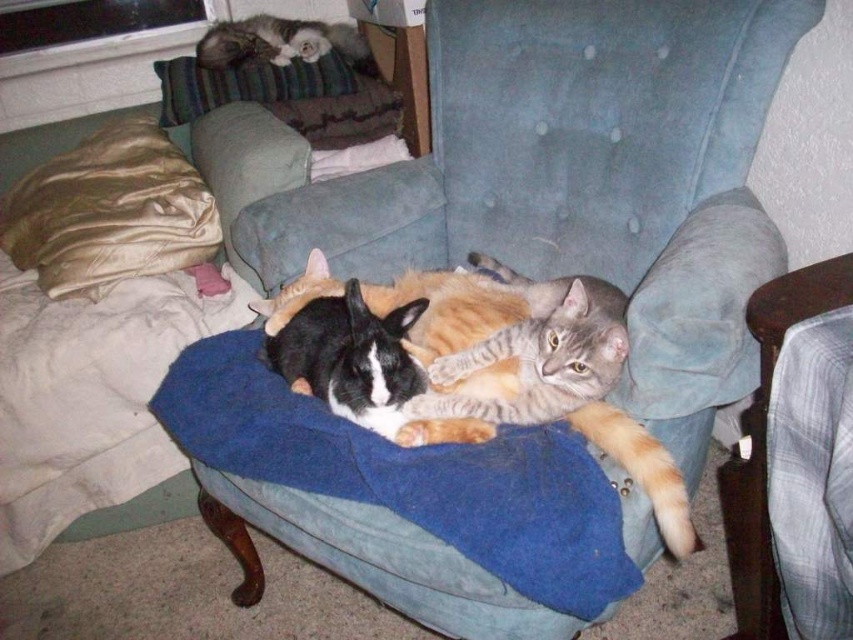
Which is below, blue fabric chair at lower right or fluffy gray cat at upper left?

Positioned lower is blue fabric chair at lower right.

Is blue fabric chair at lower right below fluffy gray cat at upper left?

Indeed, blue fabric chair at lower right is positioned under fluffy gray cat at upper left.

At what (x,y) coordinates should I click in order to perform the action: click on blue fabric chair at lower right. Please return your answer as a coordinate pair (x, y). Looking at the image, I should click on (764, 435).

Can you confirm if gray striped cat at center is positioned to the left of fluffy gray cat at upper left?

In fact, gray striped cat at center is to the right of fluffy gray cat at upper left.

Is gray striped cat at center positioned before fluffy gray cat at upper left?

Yes.

Is point (422, 440) farther from camera compared to point (242, 52)?

No, it is in front of (242, 52).

Identify the location of gray striped cat at center. This screenshot has height=640, width=853. (462, 305).

Can you confirm if gray striped cat at center is smaller than blue fabric chair at lower right?

No.

Between point (483, 312) and point (808, 280), which one is positioned behind?

The point (483, 312) is behind.

Does point (549, 284) come behind point (752, 541)?

That is False.

Identify the location of gray striped cat at center. (462, 305).